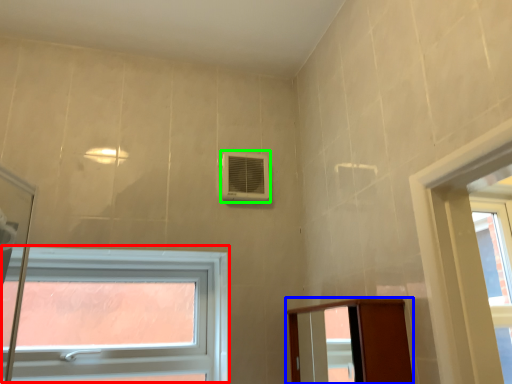
Question: Which is farther away from window (highlighted by a red box)? elevator (highlighted by a blue box) or air conditioning (highlighted by a green box)?

Choices:
 (A) elevator
 (B) air conditioning

Answer: (A)